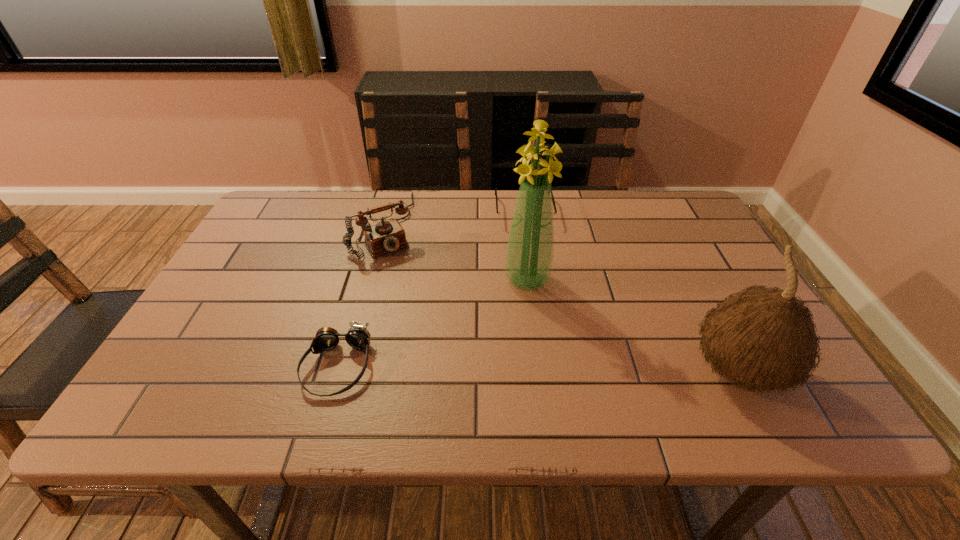
Locate an element on the screen. This screenshot has width=960, height=540. vacant area situated on the dial of the telephone is located at coordinates (438, 332).

Find the location of `vacant space located 0.110m on the dial of the telephone`. vacant space located 0.110m on the dial of the telephone is located at coordinates (407, 282).

Where is `vacant space located 0.070m on the dial of the telephone`? vacant space located 0.070m on the dial of the telephone is located at coordinates (401, 273).

Find the location of a particular element. The image size is (960, 540). free space located at the hinge ends of the spectacles is located at coordinates tap(527, 240).

The width and height of the screenshot is (960, 540). What are the coordinates of `vacant area situated 0.230m at the hinge ends of the spectacles` in the screenshot? It's located at (533, 283).

I want to click on vacant position located at the hinge ends of the spectacles, so click(530, 260).

At what (x,y) coordinates should I click in order to perform the action: click on telephone located in the far edge section of the desktop. Please return your answer as a coordinate pair (x, y). The height and width of the screenshot is (540, 960). Looking at the image, I should click on (386, 236).

Identify the location of spectacles that is at the far edge. The image size is (960, 540). (505, 217).

At what (x,y) coordinates should I click in order to perform the action: click on goggles that is at the near edge. Please return your answer as a coordinate pair (x, y). The height and width of the screenshot is (540, 960). Looking at the image, I should click on (358, 337).

Locate an element on the screen. This screenshot has width=960, height=540. coconut located in the near edge section of the desktop is located at coordinates (763, 338).